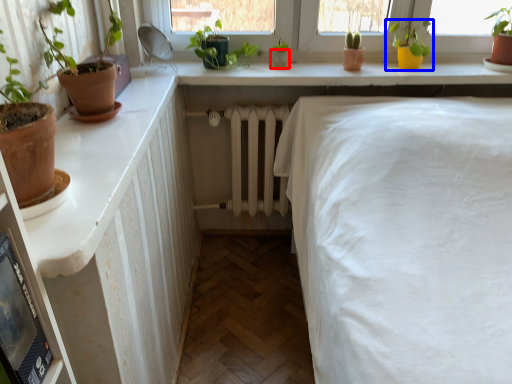
Question: Which point is further to the camera, flowerpot (highlighted by a red box) or houseplant (highlighted by a blue box)?

Choices:
 (A) flowerpot
 (B) houseplant

Answer: (A)